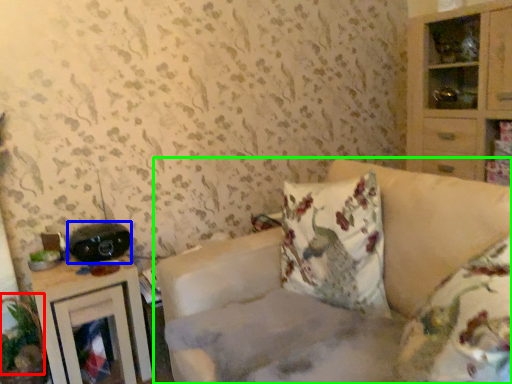
Question: Based on their relative distances, which object is farther from plant (highlighted by a red box)? Choose from stereo (highlighted by a blue box) and studio couch (highlighted by a green box).

Choices:
 (A) stereo
 (B) studio couch

Answer: (B)